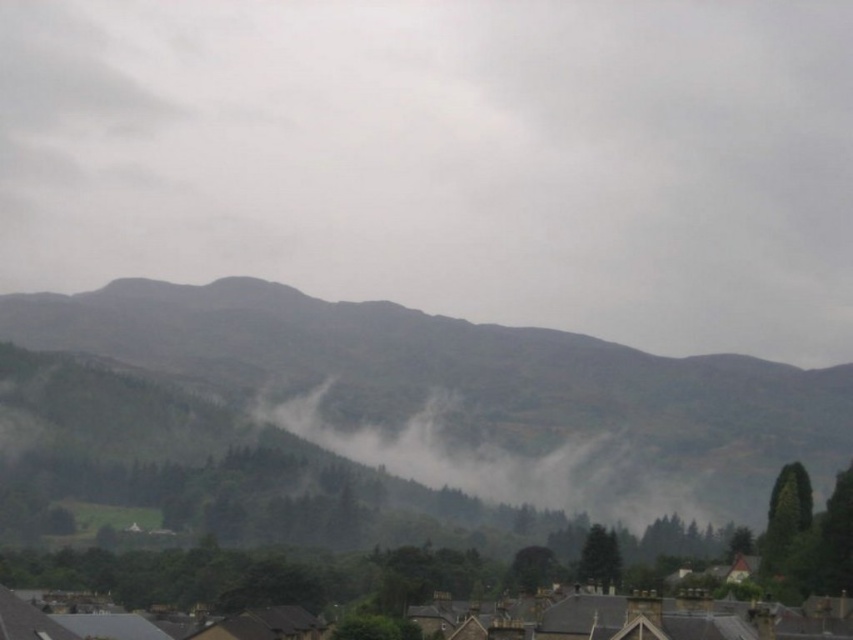
You are a hiker planning to take a photo of the green textured hillside at center from the gray foggy cloud at upper center. Given the height difference between them, do you think you can capture the entire hillside in your shot without moving your camera position?

The gray foggy cloud at upper center is much taller than the green textured hillside at center, so you can capture the entire hillside in your shot without needing to move your camera position because the cloud is higher up.

You are an artist planning to paint the scene. You want to emphasize the contrast between the gray foggy cloud at upper center and the brown stone rooftops at bottom. Which object should you make larger in your painting to achieve this effect?

To emphasize the contrast between the gray foggy cloud at upper center and the brown stone rooftops at bottom, you should make the gray foggy cloud at upper center larger since it is already larger in the scene, allowing it to stand out more against the smaller brown stone rooftops at bottom.

You are an airplane pilot flying over the landscape. You notice the gray foggy cloud at upper center and the green textured hillside at center. Which object is closer to your current altitude?

The gray foggy cloud at upper center is closer to your current altitude because the green textured hillside at center is behind it, meaning the cloud is situated between the pilot and the hillside.